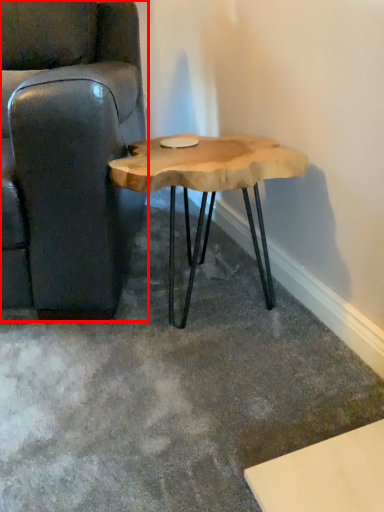
Question: From the image's perspective, what is the correct spatial positioning of chair (annotated by the red box) in reference to coffee table?

Choices:
 (A) below
 (B) above

Answer: (B)